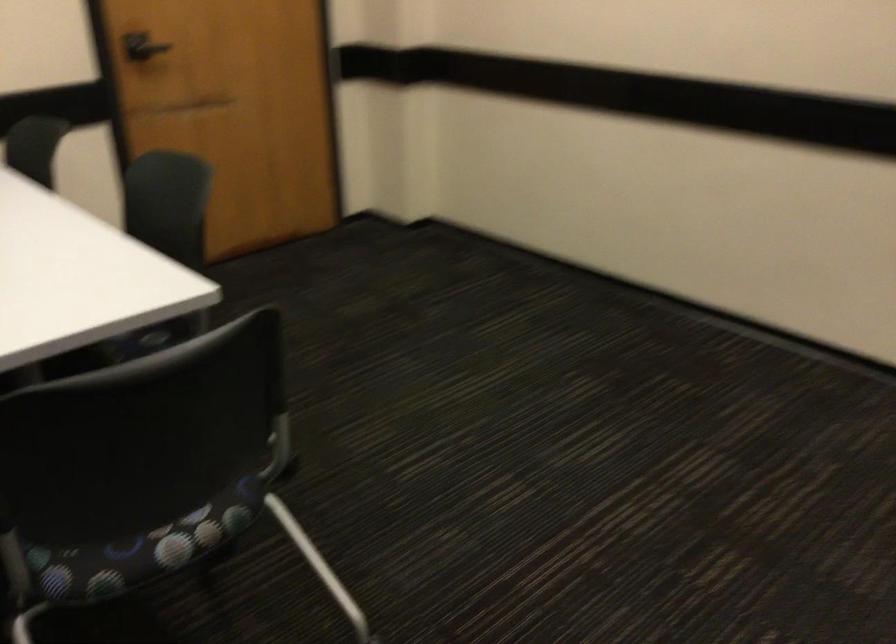
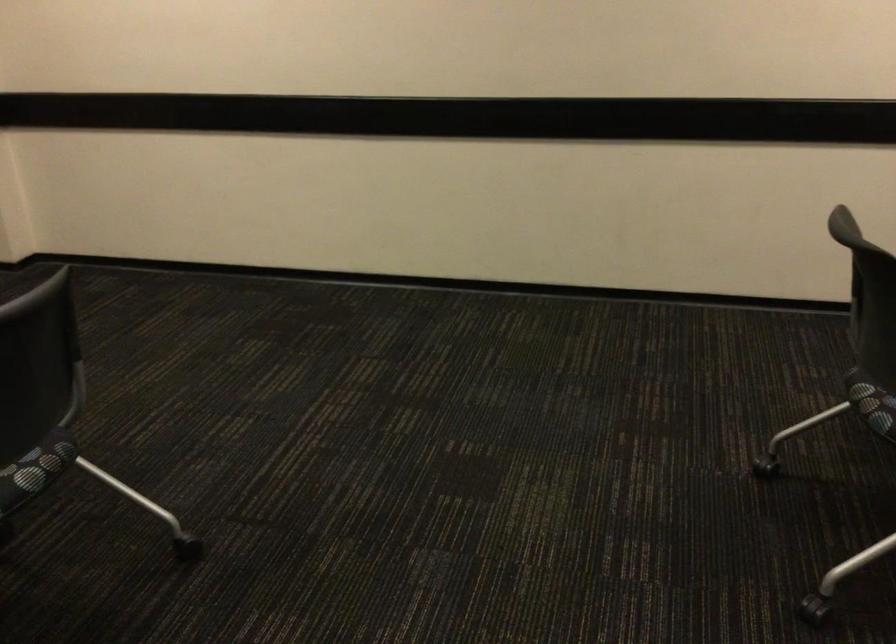
The point at (193, 533) is marked in the first image. Where is the corresponding point in the second image?

(40, 462)